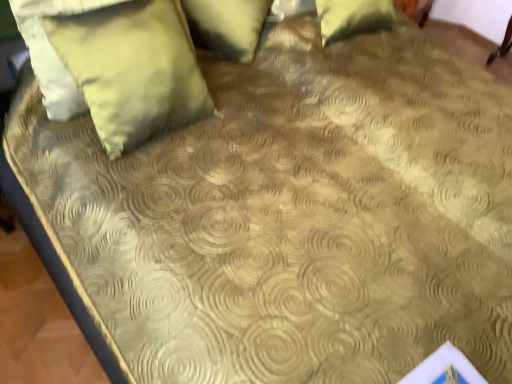
Image resolution: width=512 pixels, height=384 pixels. I want to click on green fabric pillow at upper center, the 1th pillow positioned from the top, so click(x=227, y=25).

What do you see at coordinates (227, 25) in the screenshot? I see `green fabric pillow at upper center, the 1th pillow positioned from the top` at bounding box center [227, 25].

How much space does satin yellow pillow at upper left, which is counted as the 1th pillow, starting from the bottom, occupy vertically?

21.19 inches.

Identify the location of satin yellow pillow at upper left, which is counted as the 1th pillow, starting from the bottom. The width and height of the screenshot is (512, 384). (132, 69).

This screenshot has width=512, height=384. What do you see at coordinates (132, 69) in the screenshot?
I see `satin yellow pillow at upper left, which is the second pillow in top-to-bottom order` at bounding box center [132, 69].

Where is `green fabric pillow at upper center, the 2th pillow positioned from the bottom`? green fabric pillow at upper center, the 2th pillow positioned from the bottom is located at coordinates (227, 25).

Which object is positioned more to the right, green fabric pillow at upper center, the 2th pillow positioned from the bottom, or satin yellow pillow at upper left, which is counted as the 1th pillow, starting from the bottom?

green fabric pillow at upper center, the 2th pillow positioned from the bottom, is more to the right.

Relative to satin yellow pillow at upper left, which is the second pillow in top-to-bottom order, is green fabric pillow at upper center, the 2th pillow positioned from the bottom, in front or behind?

Visually, green fabric pillow at upper center, the 2th pillow positioned from the bottom, is located behind satin yellow pillow at upper left, which is the second pillow in top-to-bottom order.

Does point (251, 27) appear closer or farther from the camera than point (160, 101)?

Point (251, 27) is farther from the camera than point (160, 101).

From the image's perspective, is green fabric pillow at upper center, the 2th pillow positioned from the bottom, below satin yellow pillow at upper left, which is counted as the 1th pillow, starting from the bottom?

No, from the image's perspective, green fabric pillow at upper center, the 2th pillow positioned from the bottom, is not below satin yellow pillow at upper left, which is counted as the 1th pillow, starting from the bottom.

From a real-world perspective, is green fabric pillow at upper center, the 1th pillow positioned from the top, positioned over satin yellow pillow at upper left, which is the second pillow in top-to-bottom order, based on gravity?

No, from a real-world perspective, green fabric pillow at upper center, the 1th pillow positioned from the top, is not over satin yellow pillow at upper left, which is the second pillow in top-to-bottom order

Does green fabric pillow at upper center, the 2th pillow positioned from the bottom, have a greater width compared to satin yellow pillow at upper left, which is counted as the 1th pillow, starting from the bottom?

Yes.

Consider the image. Considering the relative sizes of green fabric pillow at upper center, the 2th pillow positioned from the bottom, and satin yellow pillow at upper left, which is the second pillow in top-to-bottom order, in the image provided, is green fabric pillow at upper center, the 2th pillow positioned from the bottom, shorter than satin yellow pillow at upper left, which is the second pillow in top-to-bottom order,?

Correct, green fabric pillow at upper center, the 2th pillow positioned from the bottom, is not as tall as satin yellow pillow at upper left, which is the second pillow in top-to-bottom order.

Is green fabric pillow at upper center, the 2th pillow positioned from the bottom, bigger than satin yellow pillow at upper left, which is the second pillow in top-to-bottom order?

Yes.

Do you think green fabric pillow at upper center, the 1th pillow positioned from the top, is within satin yellow pillow at upper left, which is counted as the 1th pillow, starting from the bottom, or outside of it?

green fabric pillow at upper center, the 1th pillow positioned from the top, is spatially situated outside satin yellow pillow at upper left, which is counted as the 1th pillow, starting from the bottom.

Does green fabric pillow at upper center, the 1th pillow positioned from the top, touch satin yellow pillow at upper left, which is counted as the 1th pillow, starting from the bottom?

No, green fabric pillow at upper center, the 1th pillow positioned from the top, is not with satin yellow pillow at upper left, which is counted as the 1th pillow, starting from the bottom.

Is green fabric pillow at upper center, the 1th pillow positioned from the top, oriented towards satin yellow pillow at upper left, which is counted as the 1th pillow, starting from the bottom?

Yes, green fabric pillow at upper center, the 1th pillow positioned from the top, is oriented towards satin yellow pillow at upper left, which is counted as the 1th pillow, starting from the bottom.

What's the angular difference between green fabric pillow at upper center, the 1th pillow positioned from the top, and satin yellow pillow at upper left, which is the second pillow in top-to-bottom order,'s facing directions?

The angle between the facing direction of green fabric pillow at upper center, the 1th pillow positioned from the top, and the facing direction of satin yellow pillow at upper left, which is the second pillow in top-to-bottom order, is 36.2 degrees.

Image resolution: width=512 pixels, height=384 pixels. What are the coordinates of `pillow below the satin yellow pillow at upper left, which is counted as the 1th pillow, starting from the bottom (from a real-world perspective)` in the screenshot? It's located at 227,25.

Would you say satin yellow pillow at upper left, which is the second pillow in top-to-bottom order, is to the left or to the right of green fabric pillow at upper center, the 1th pillow positioned from the top, in the picture?

Based on their positions, satin yellow pillow at upper left, which is the second pillow in top-to-bottom order, is located to the left of green fabric pillow at upper center, the 1th pillow positioned from the top.

Considering the relative positions of satin yellow pillow at upper left, which is counted as the 1th pillow, starting from the bottom, and green fabric pillow at upper center, the 1th pillow positioned from the top, in the image provided, is satin yellow pillow at upper left, which is counted as the 1th pillow, starting from the bottom, behind green fabric pillow at upper center, the 1th pillow positioned from the top,?

No, satin yellow pillow at upper left, which is counted as the 1th pillow, starting from the bottom, is in front of green fabric pillow at upper center, the 1th pillow positioned from the top.

Considering the positions of point (92, 35) and point (208, 18), is point (92, 35) closer or farther from the camera than point (208, 18)?

Point (92, 35).

From the image's perspective, between satin yellow pillow at upper left, which is the second pillow in top-to-bottom order, and green fabric pillow at upper center, the 2th pillow positioned from the bottom, who is located below?

satin yellow pillow at upper left, which is the second pillow in top-to-bottom order, is shown below in the image.

Looking at this image, from a real-world perspective, who is located lower, satin yellow pillow at upper left, which is counted as the 1th pillow, starting from the bottom, or green fabric pillow at upper center, the 1th pillow positioned from the top?

In real-world perspective, green fabric pillow at upper center, the 1th pillow positioned from the top, is lower.

In the scene shown: Between satin yellow pillow at upper left, which is counted as the 1th pillow, starting from the bottom, and green fabric pillow at upper center, the 1th pillow positioned from the top, which one has larger width?

With larger width is green fabric pillow at upper center, the 1th pillow positioned from the top.

From the picture: Does satin yellow pillow at upper left, which is counted as the 1th pillow, starting from the bottom, have a greater height compared to green fabric pillow at upper center, the 1th pillow positioned from the top?

Correct, satin yellow pillow at upper left, which is counted as the 1th pillow, starting from the bottom, is much taller as green fabric pillow at upper center, the 1th pillow positioned from the top.

From the picture: Who is smaller, satin yellow pillow at upper left, which is the second pillow in top-to-bottom order, or green fabric pillow at upper center, the 2th pillow positioned from the bottom?

With smaller size is satin yellow pillow at upper left, which is the second pillow in top-to-bottom order.

Is green fabric pillow at upper center, the 2th pillow positioned from the bottom, a part of satin yellow pillow at upper left, which is counted as the 1th pillow, starting from the bottom?

No, green fabric pillow at upper center, the 2th pillow positioned from the bottom, is located outside of satin yellow pillow at upper left, which is counted as the 1th pillow, starting from the bottom.

Is satin yellow pillow at upper left, which is the second pillow in top-to-bottom order, next to green fabric pillow at upper center, the 2th pillow positioned from the bottom?

No, satin yellow pillow at upper left, which is the second pillow in top-to-bottom order, is not making contact with green fabric pillow at upper center, the 2th pillow positioned from the bottom.

Is satin yellow pillow at upper left, which is the second pillow in top-to-bottom order, looking in the opposite direction of green fabric pillow at upper center, the 2th pillow positioned from the bottom?

That's not correct — satin yellow pillow at upper left, which is the second pillow in top-to-bottom order, is not looking away from green fabric pillow at upper center, the 2th pillow positioned from the bottom.

How many degrees apart are the facing directions of satin yellow pillow at upper left, which is the second pillow in top-to-bottom order, and green fabric pillow at upper center, the 1th pillow positioned from the top?

There is a 36.2-degree angle between the facing directions of satin yellow pillow at upper left, which is the second pillow in top-to-bottom order, and green fabric pillow at upper center, the 1th pillow positioned from the top.

Find the location of a particular element. pillow behind the satin yellow pillow at upper left, which is counted as the 1th pillow, starting from the bottom is located at coordinates (227, 25).

Image resolution: width=512 pixels, height=384 pixels. I want to click on pillow above the satin yellow pillow at upper left, which is counted as the 1th pillow, starting from the bottom (from the image's perspective), so click(227, 25).

Identify the location of pillow located on the left of green fabric pillow at upper center, the 2th pillow positioned from the bottom. The image size is (512, 384). point(132,69).